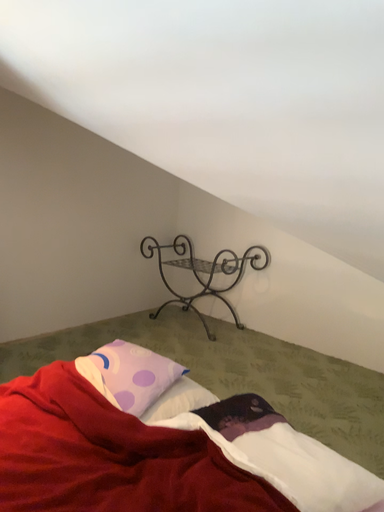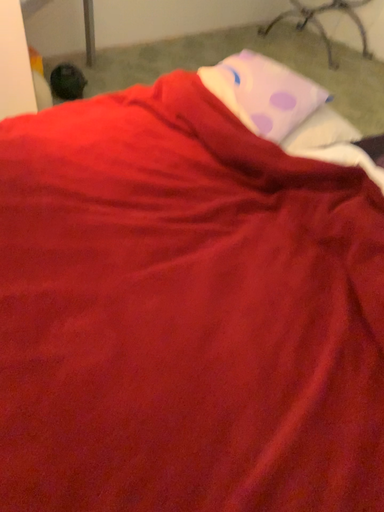
Question: Which way did the camera rotate in the video?

Choices:
 (A) rotated right
 (B) rotated left

Answer: (B)